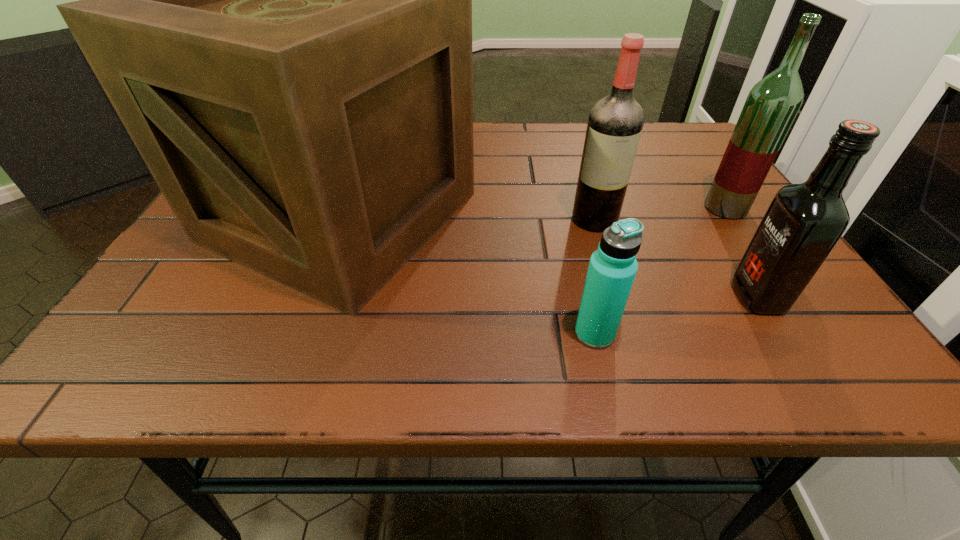
Locate an element on the screen. free spot located on the left of the nearest object is located at coordinates (366, 334).

The width and height of the screenshot is (960, 540). What are the coordinates of `object that is at the far edge` in the screenshot? It's located at (277, 0).

Locate an element on the screen. object situated at the near edge is located at coordinates (613, 266).

The height and width of the screenshot is (540, 960). What are the coordinates of `object that is at the left edge` in the screenshot? It's located at (277, 0).

Locate an element on the screen. object that is at the far left corner is located at coordinates (277, 0).

Locate an element on the screen. The image size is (960, 540). vacant region at the far edge of the desktop is located at coordinates (574, 137).

The width and height of the screenshot is (960, 540). Identify the location of blank space at the near edge. (320, 345).

This screenshot has width=960, height=540. In the image, there is a desktop. What are the coordinates of `vacant region at the left edge` in the screenshot? It's located at (177, 266).

Identify the location of free spot at the right edge of the desktop. The image size is (960, 540). point(681,198).

Where is `vacant region at the far right corner`? The image size is (960, 540). vacant region at the far right corner is located at coordinates 675,164.